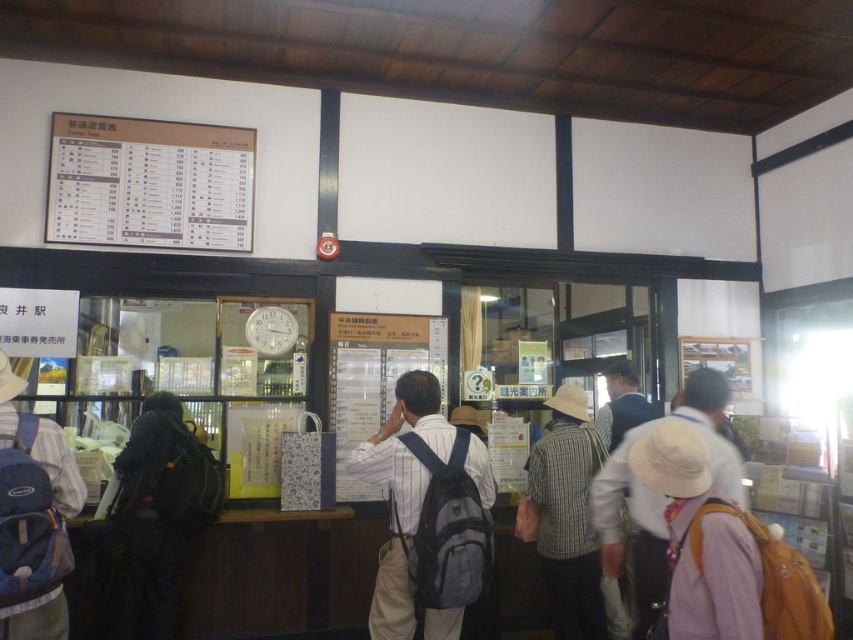
You are standing in the train station ticket office and need to reach the counter. There is a blue backpack at left blocking your path. Can you walk around it? Please explain based on its position.

The blue backpack at left is located at point (33, 516), which is near the lower left corner of the image. Since it is positioned close to the edge, you can easily walk around it to access the counter.

You are a traveler standing in the train station ticket office and notice two items at the center of the scene. Which item is positioned closer to you, the matte gray backpack at center or the plaid fabric shirt at center?

The matte gray backpack at center is closer to the viewer than the plaid fabric shirt at center.

You are a traveler who wants to check the height of your backpacks to ensure they fit in the overhead compartments of the train. The overhead compartments have a maximum height limit of 50 cm. You see the matte gray backpack at center and the blue backpack at left. Which backpack is more likely to exceed the height limit?

The matte gray backpack at center is much taller than the blue backpack at left, so it is more likely to exceed the 50 cm height limit and not fit in the overhead compartments.